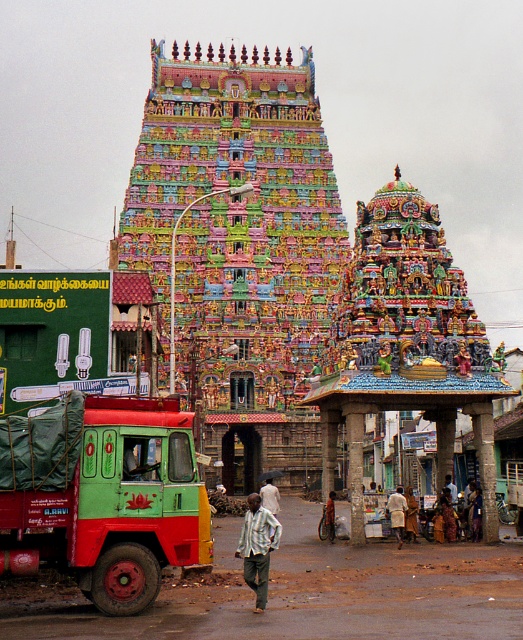
Can you confirm if light blue fabric shirt at center is positioned to the right of orange fabric shirt at center?

In fact, light blue fabric shirt at center is to the left of orange fabric shirt at center.

This screenshot has width=523, height=640. Find the location of `light blue fabric shirt at center`. light blue fabric shirt at center is located at coordinates (269, 497).

What do you see at coordinates (269, 497) in the screenshot? This screenshot has width=523, height=640. I see `light blue fabric shirt at center` at bounding box center [269, 497].

Find the location of `light blue fabric shirt at center`. light blue fabric shirt at center is located at coordinates (269, 497).

Can you confirm if multicolored painted temple at center is smaller than carved stone pillar at center?

No.

At what (x,y) coordinates should I click in order to perform the action: click on multicolored painted temple at center. Please return your answer as a coordinate pair (x, y). This screenshot has height=640, width=523. Looking at the image, I should click on (237, 220).

Find the location of `multicolored painted temple at center`. multicolored painted temple at center is located at coordinates (237, 220).

Does multicolored painted temple at center have a lesser height compared to polished gold statue at center?

In fact, multicolored painted temple at center may be taller than polished gold statue at center.

Does multicolored painted temple at center appear under polished gold statue at center?

Incorrect, multicolored painted temple at center is not positioned below polished gold statue at center.

Locate an element on the screen. The height and width of the screenshot is (640, 523). multicolored painted temple at center is located at coordinates (237, 220).